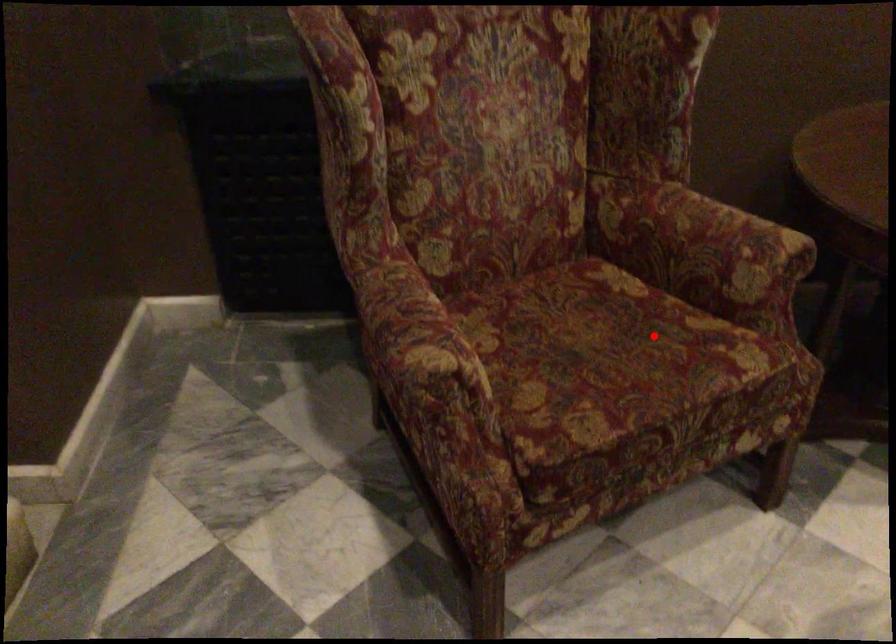
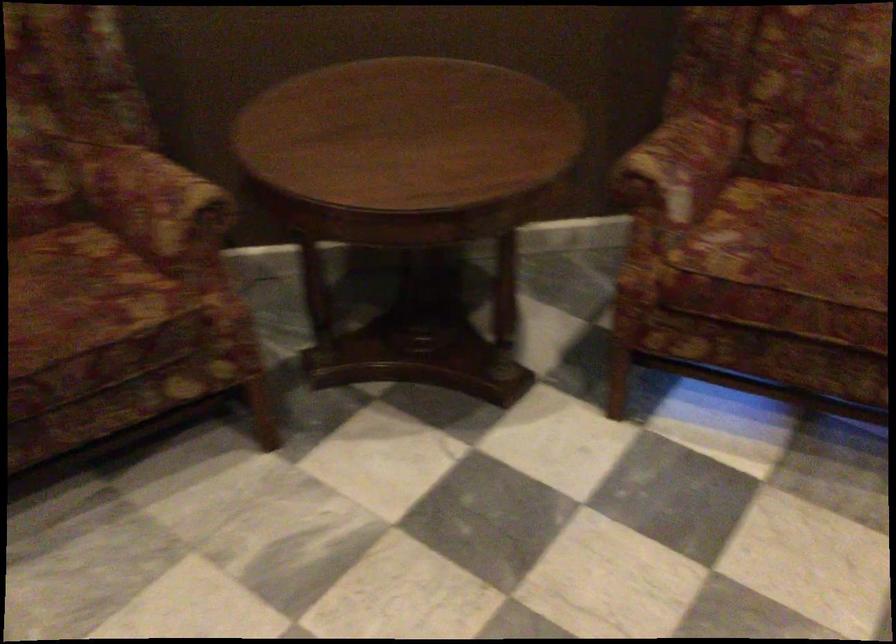
Locate, in the second image, the point that corresponds to the highlighted location in the first image.

(80, 292)